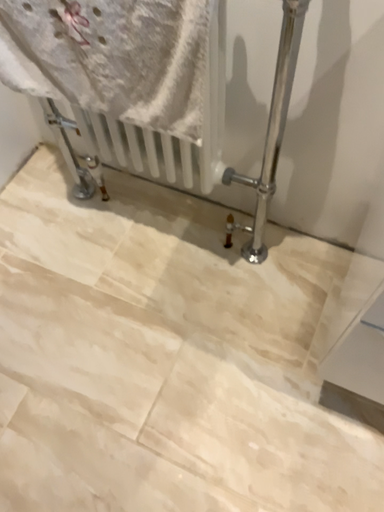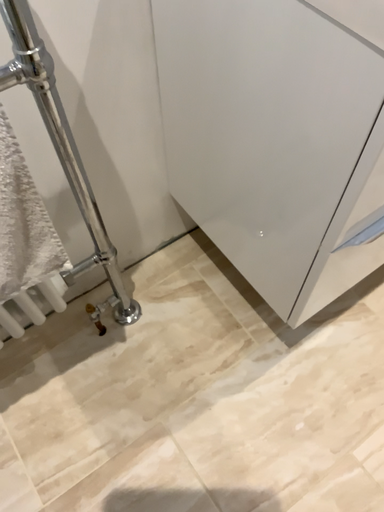
Question: How did the camera likely rotate when shooting the video?

Choices:
 (A) rotated downward
 (B) rotated upward

Answer: (B)